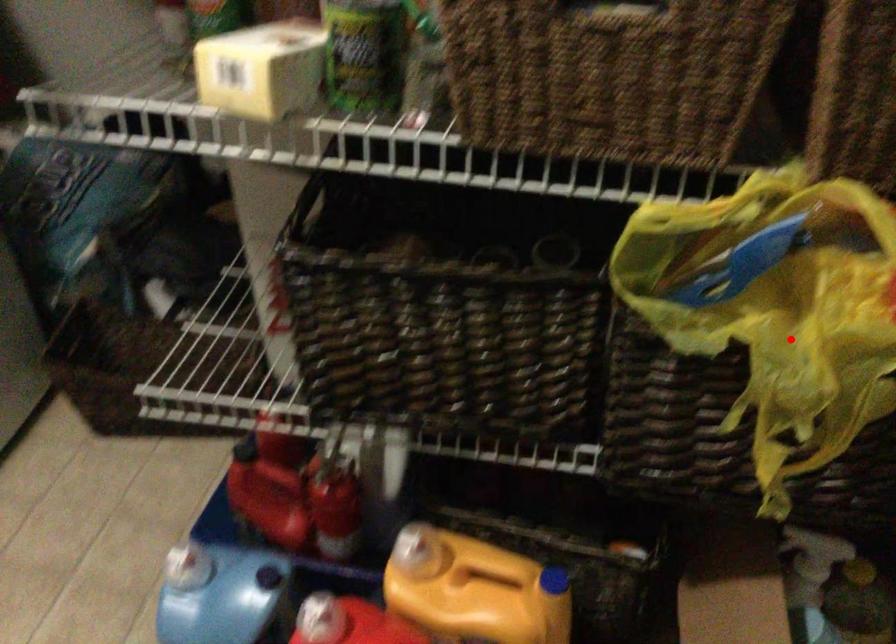
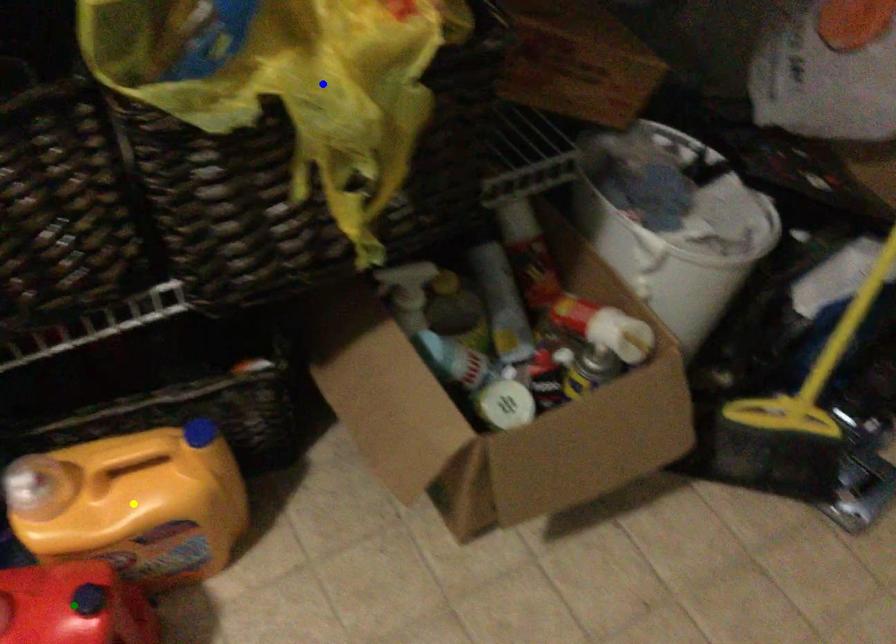
Question: I am providing you with two images of the same scene from different viewpoints. A red point is marked on the first image. You are given multiple points on the second image. Which point in image 2 represents the same 3d spot as the red point in image 1?

Choices:
 (A) yellow point
 (B) green point
 (C) blue point

Answer: (C)